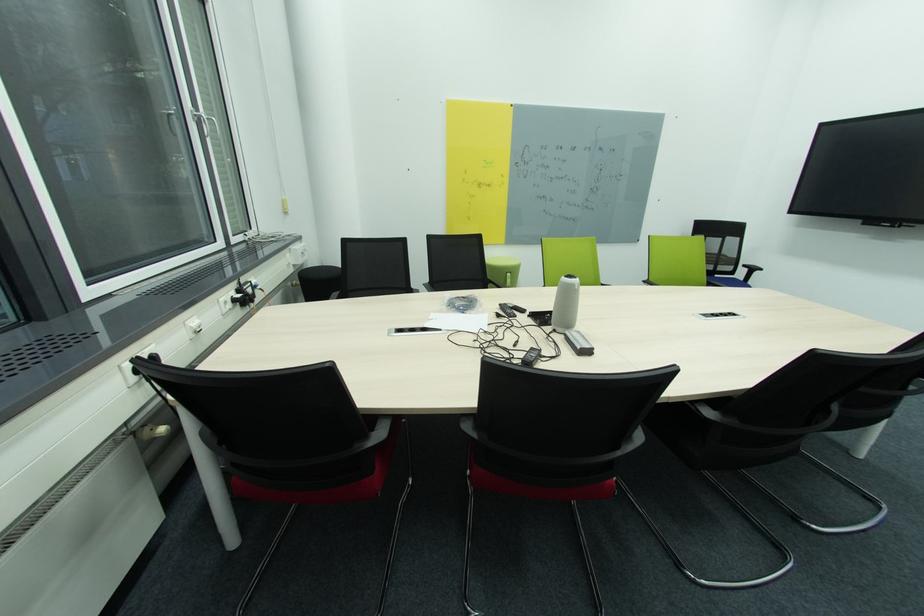
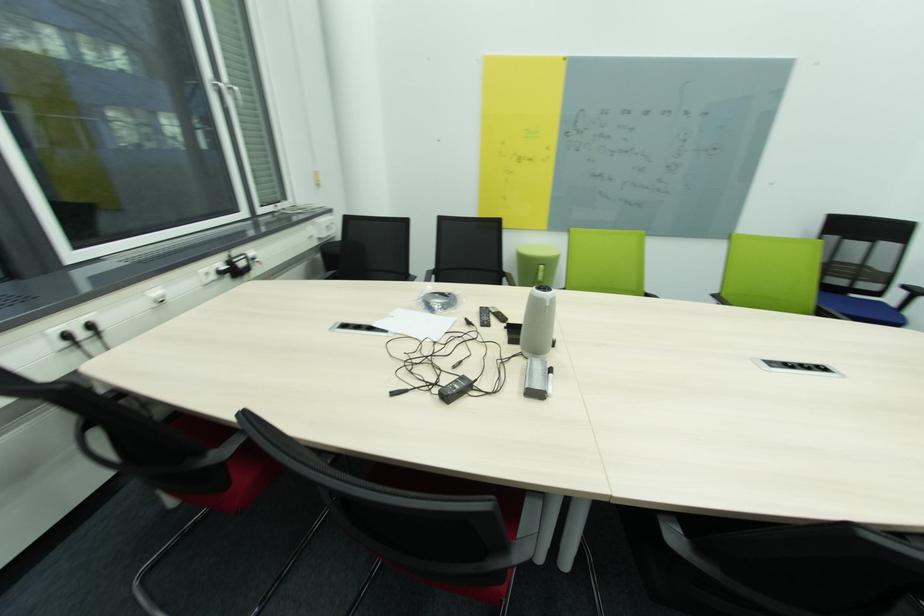
Question: Based on the continuous images, in which direction is the camera rotating? Reply with the corresponding letter.

Choices:
 (A) Left
 (B) Right
 (C) Up
 (D) Down

Answer: (A)